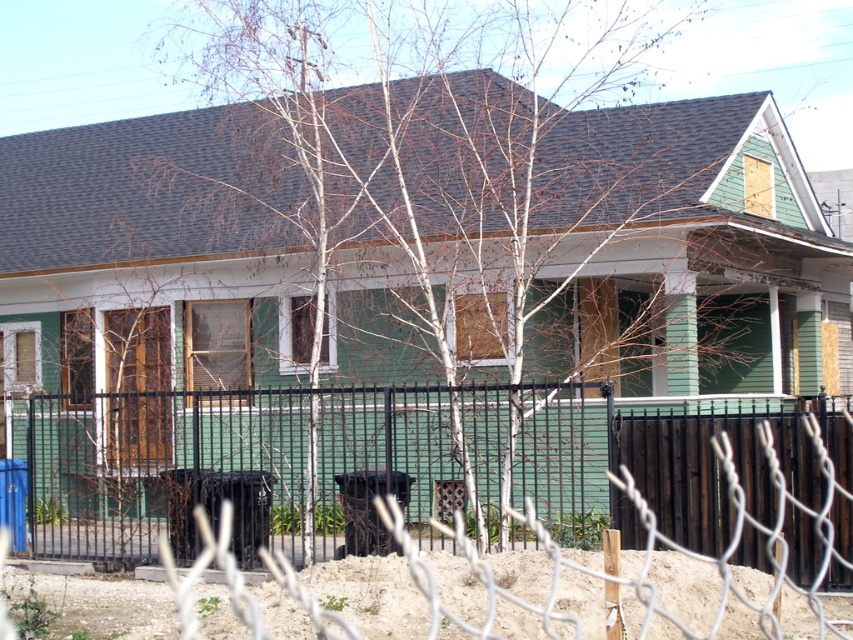
You are standing at the entrance of the house and want to place a new decorative planter exactly at the point where the black metal fence at center is located. What are the coordinates of the point where you should place the planter?

The coordinates for the black metal fence at center are at point (310,465), so you should place the planter there.

You are standing in front of the house and want to see the dark brown wood fence at center. Is the black metal fence at center blocking your view of it?

The black metal fence at center is positioned under the dark brown wood fence at center, so it is blocking the view of the dark brown wood fence at center.